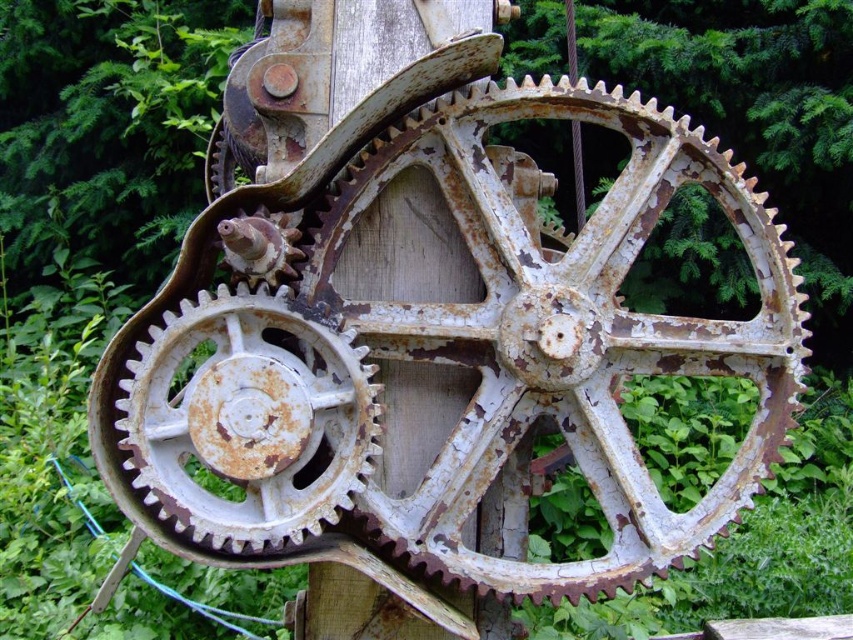
Question: Is rusty metal gear at center to the right of rusty white gear at center from the viewer's perspective?

Choices:
 (A) yes
 (B) no

Answer: (A)

Question: Is rusty metal gear at center positioned at the back of rusty white gear at center?

Choices:
 (A) no
 (B) yes

Answer: (B)

Question: Which point is farther to the camera?

Choices:
 (A) rusty metal gear at center
 (B) rusty white gear at center

Answer: (A)

Question: Among these points, which one is farthest from the camera?

Choices:
 (A) (625, 442)
 (B) (235, 330)

Answer: (A)

Question: Is rusty metal gear at center closer to camera compared to rusty white gear at center?

Choices:
 (A) yes
 (B) no

Answer: (B)